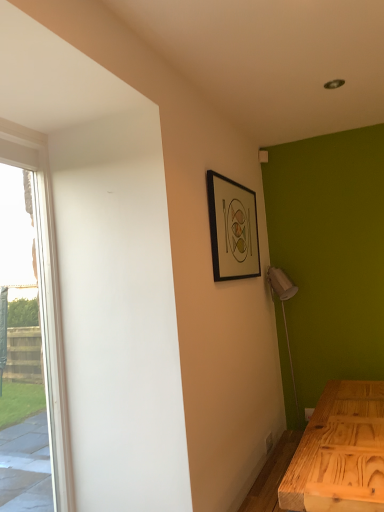
You are a GUI agent. You are given a task and a screenshot of the screen. Output one action in this format:
    pyautogui.click(x=<x>, y=<y>)
    Task: Click on the black matte picture frame at upper right
    The image size is (384, 512).
    Given the screenshot: What is the action you would take?
    pyautogui.click(x=232, y=229)

The height and width of the screenshot is (512, 384). What do you see at coordinates (232, 229) in the screenshot?
I see `black matte picture frame at upper right` at bounding box center [232, 229].

In order to face clear glass window at left, should I rotate leftwards or rightwards?

To face it directly, rotate left by 21.067 degrees.

The image size is (384, 512). What do you see at coordinates (46, 300) in the screenshot? I see `clear glass window at left` at bounding box center [46, 300].

The height and width of the screenshot is (512, 384). Identify the location of clear glass window at left. 46,300.

In order to click on black matte picture frame at upper right in this screenshot , I will do `click(232, 229)`.

Is black matte picture frame at upper right at the right side of clear glass window at left?

Yes, black matte picture frame at upper right is to the right of clear glass window at left.

In the image, is black matte picture frame at upper right positioned in front of or behind clear glass window at left?

black matte picture frame at upper right is behind clear glass window at left.

Considering the positions of point (252, 271) and point (54, 238), is point (252, 271) closer or farther from the camera than point (54, 238)?

Point (252, 271) is positioned farther from the camera compared to point (54, 238).

From the image's perspective, which is below, black matte picture frame at upper right or clear glass window at left?

clear glass window at left is shown below in the image.

From a real-world perspective, is black matte picture frame at upper right located higher than clear glass window at left?

Correct, in the physical world, black matte picture frame at upper right is higher than clear glass window at left.

Can you confirm if black matte picture frame at upper right is thinner than clear glass window at left?

Yes, black matte picture frame at upper right is thinner than clear glass window at left.

From their relative heights in the image, would you say black matte picture frame at upper right is taller or shorter than clear glass window at left?

In the image, black matte picture frame at upper right appears to be shorter than clear glass window at left.

Considering the relative sizes of black matte picture frame at upper right and clear glass window at left in the image provided, is black matte picture frame at upper right smaller than clear glass window at left?

Indeed, black matte picture frame at upper right has a smaller size compared to clear glass window at left.

Is black matte picture frame at upper right not inside clear glass window at left?

Indeed, black matte picture frame at upper right is completely outside clear glass window at left.

Is black matte picture frame at upper right placed right next to clear glass window at left?

No, black matte picture frame at upper right is not in contact with clear glass window at left.

Could you tell me if black matte picture frame at upper right is facing clear glass window at left?

No.

How distant is black matte picture frame at upper right from clear glass window at left?

They are 94.30 centimeters apart.

Locate an element on the screen. picture frame that is above the clear glass window at left (from the image's perspective) is located at coordinates (232, 229).

In the scene shown: Which object is positioned more to the left, clear glass window at left or black matte picture frame at upper right?

Positioned to the left is clear glass window at left.

Between clear glass window at left and black matte picture frame at upper right, which one is positioned behind?

black matte picture frame at upper right is behind.

Considering the positions of point (37, 135) and point (221, 259), is point (37, 135) closer or farther from the camera than point (221, 259)?

Point (37, 135) appears to be closer to the viewer than point (221, 259).

From the image's perspective, between clear glass window at left and black matte picture frame at upper right, who is located below?

clear glass window at left, from the image's perspective.

Based on the photo, from a real-world perspective, is clear glass window at left located higher than black matte picture frame at upper right?

Incorrect, from a real-world perspective, clear glass window at left is lower than black matte picture frame at upper right.

Which object is thinner, clear glass window at left or black matte picture frame at upper right?

With smaller width is black matte picture frame at upper right.

Considering the sizes of objects clear glass window at left and black matte picture frame at upper right in the image provided, who is taller, clear glass window at left or black matte picture frame at upper right?

With more height is clear glass window at left.

Which of these two, clear glass window at left or black matte picture frame at upper right, is smaller?

Smaller between the two is black matte picture frame at upper right.

Is clear glass window at left located outside black matte picture frame at upper right?

Yes, clear glass window at left is outside of black matte picture frame at upper right.

Is clear glass window at left next to black matte picture frame at upper right and touching it?

No, clear glass window at left is not touching black matte picture frame at upper right.

From the picture: Is clear glass window at left looking in the opposite direction of black matte picture frame at upper right?

That's not correct — clear glass window at left is not looking away from black matte picture frame at upper right.

What's the angular difference between clear glass window at left and black matte picture frame at upper right's facing directions?

The facing directions of clear glass window at left and black matte picture frame at upper right are 2.18 degrees apart.

How much distance is there between clear glass window at left and black matte picture frame at upper right?

clear glass window at left and black matte picture frame at upper right are 37.12 inches apart.

Where is `picture frame behind the clear glass window at left`? picture frame behind the clear glass window at left is located at coordinates (232, 229).

Image resolution: width=384 pixels, height=512 pixels. Find the location of `window on the left side of black matte picture frame at upper right`. window on the left side of black matte picture frame at upper right is located at coordinates (46, 300).

This screenshot has height=512, width=384. I want to click on window beneath the black matte picture frame at upper right (from a real-world perspective), so click(46, 300).